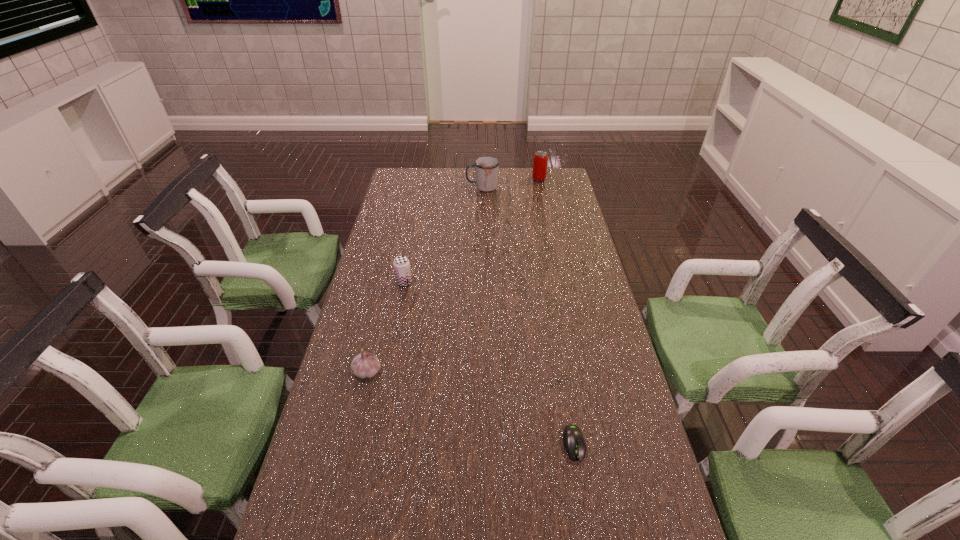
Identify the location of unoccupied area between the nearest object and the taller beer can. (557, 312).

At what (x,y) coordinates should I click in order to perform the action: click on empty space that is in between the third farthest object and the farther beer can. Please return your answer as a coordinate pair (x, y). Looking at the image, I should click on (471, 231).

The width and height of the screenshot is (960, 540). I want to click on free space between the mug and the shorter beer can, so click(x=444, y=235).

Where is `vacant area between the nearer beer can and the taller beer can`? vacant area between the nearer beer can and the taller beer can is located at coordinates (471, 231).

I want to click on vacant area that lies between the second nearest object and the computer mouse, so click(x=470, y=408).

I want to click on the closest object to the mug, so click(539, 172).

Locate an element on the screen. object that is the closest to the shorter beer can is located at coordinates (365, 365).